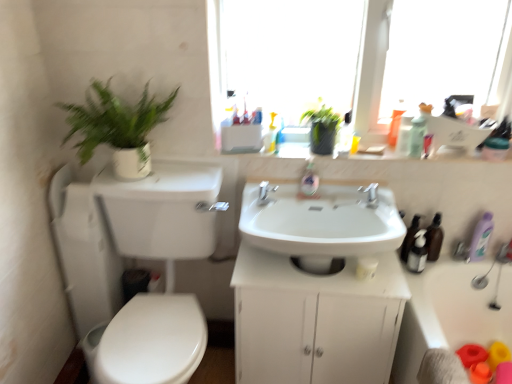
Locate an element on the screen. The height and width of the screenshot is (384, 512). vacant space that is to the left of translucent orange soap dispenser at upper right, which is counted as the second toiletry, starting from the left is located at coordinates (362, 149).